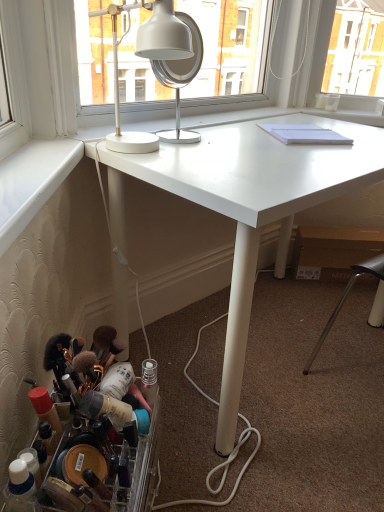
At what (x,y) coordinates should I click in order to perform the action: click on free space below white matte desk at center (from a real-world perspective). Please return your answer as a coordinate pair (x, y). Looking at the image, I should click on (261, 338).